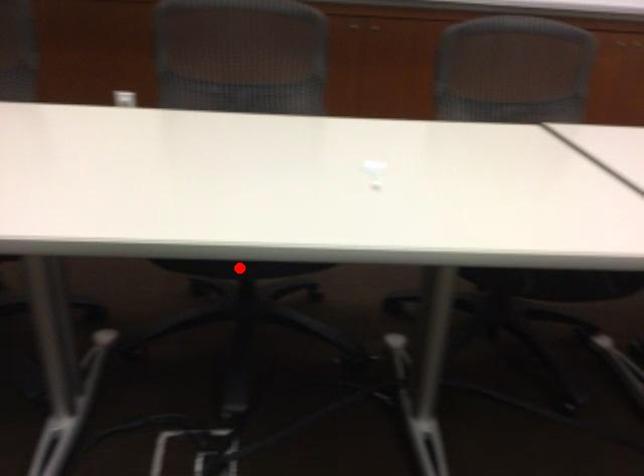
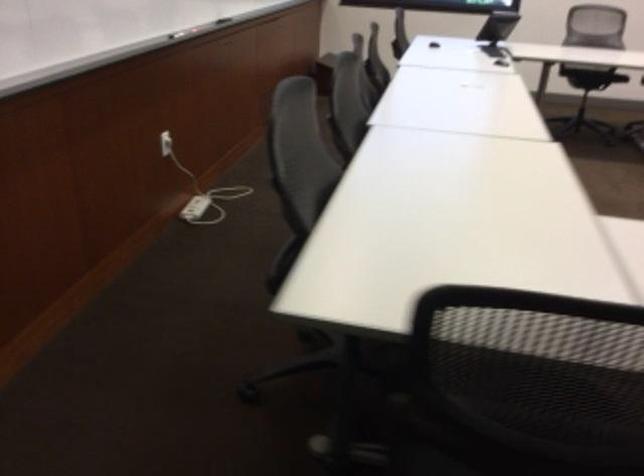
Question: I am providing you with two images of the same scene from different viewpoints. A red point is marked on the first image. Is the red point's position out of view in image 2?

Choices:
 (A) Yes
 (B) No

Answer: (A)